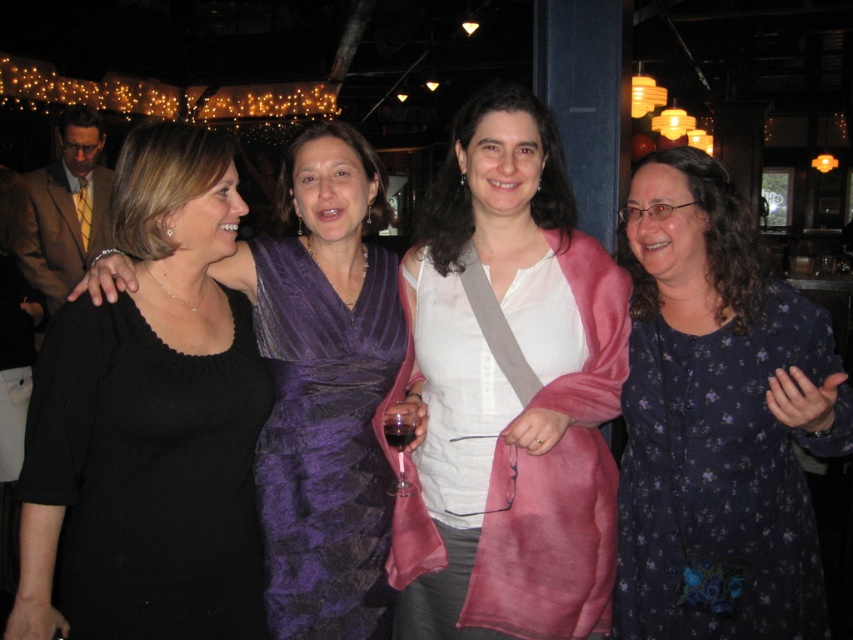
You are standing in the center of the room and want to hand a gift to the person wearing the dark blue floral dress at right. In which direction should you move to reach her?

The dark blue floral dress at right is located at point 0.750 on the x axis and 0.848 on the y axis. Since you are at the center, you should move towards the right and slightly forward to reach her.

You are standing in the venue and want to take a photo of the black knitted dress at left. Where should you position yourself to capture it in the frame?

To capture the black knitted dress at left in the frame, position yourself so that the dress is centered at coordinates approximately 0.744 on the x axis and 0.175 on the y axis based on the image coordinates system.

You are standing at the entrance of the venue and want to locate the purple satin dress at center. According to the coordinates provided, where should you look relative to the center of the image?

The purple satin dress at center is located at coordinates point (325, 442), which means it is positioned slightly to the right and above the center of the image.